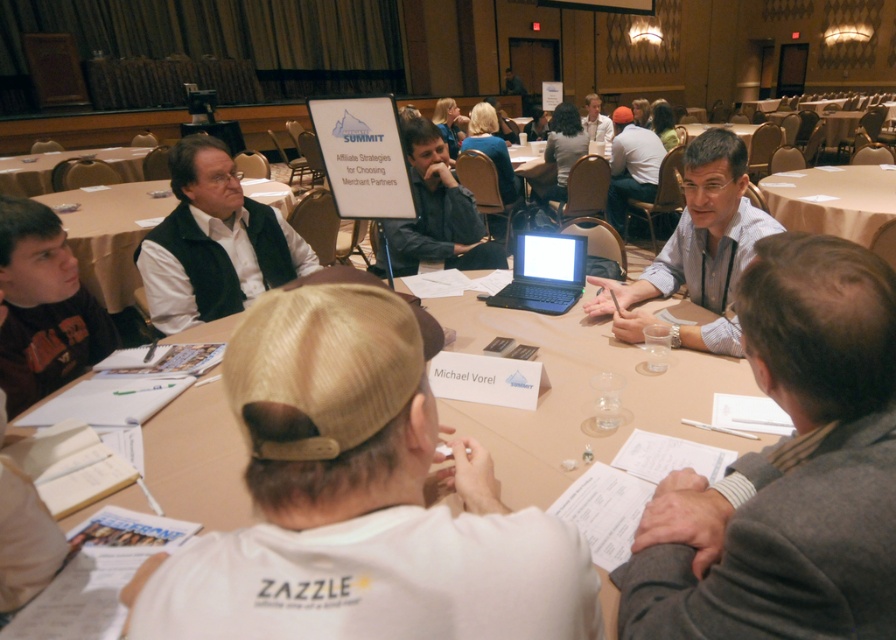
Who is shorter, matte white table at center or light brown wood table at center?

Standing shorter between the two is light brown wood table at center.

Can you confirm if matte white table at center is bigger than light brown wood table at center?

Correct, matte white table at center is larger in size than light brown wood table at center.

Find the location of a particular element. matte white table at center is located at coordinates (110, 234).

Does black matte vest at upper left appear on the right side of matte white table at center?

Indeed, black matte vest at upper left is positioned on the right side of matte white table at center.

Between black matte vest at upper left and matte white table at center, which one appears on the right side from the viewer's perspective?

Positioned to the right is black matte vest at upper left.

Describe the element at coordinates (213, 243) in the screenshot. Image resolution: width=896 pixels, height=640 pixels. I see `black matte vest at upper left` at that location.

At what (x,y) coordinates should I click in order to perform the action: click on black matte vest at upper left. Please return your answer as a coordinate pair (x, y). This screenshot has height=640, width=896. Looking at the image, I should click on (213, 243).

Does point (138, 161) come behind point (590, 140)?

No.

Can you confirm if light brown wood table at left is wider than light blue shirt at upper center?

Yes.

Where is `light brown wood table at left`? The height and width of the screenshot is (640, 896). light brown wood table at left is located at coordinates pyautogui.click(x=59, y=161).